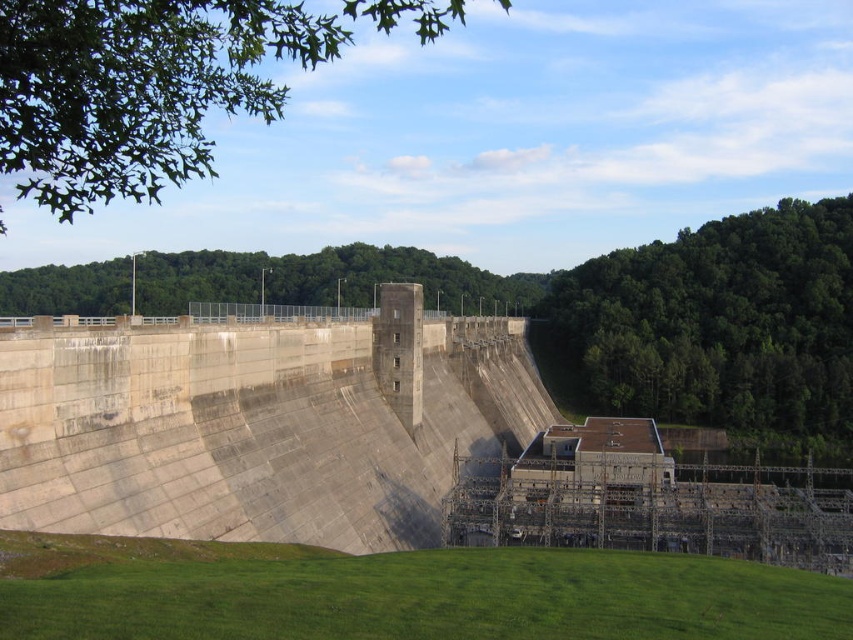
Is point (672, 380) positioned in front of point (1, 292)?

Yes, point (672, 380) is closer to viewer.

Is point (791, 368) farther from camera compared to point (28, 275)?

No, it is in front of (28, 275).

This screenshot has width=853, height=640. Identify the location of green leafy tree at right. (718, 323).

In the scene shown: Who is higher up, gray concrete dam at center or green leafy tree at right?

green leafy tree at right

Is gray concrete dam at center shorter than green leafy tree at right?

Yes.

Between point (531, 433) and point (709, 266), which one is positioned in front?

Point (531, 433) is in front.

You are a GUI agent. You are given a task and a screenshot of the screen. Output one action in this format:
    pyautogui.click(x=<x>, y=<y>)
    Task: Click on the gray concrete dam at center
    The height and width of the screenshot is (640, 853).
    Given the screenshot: What is the action you would take?
    pyautogui.click(x=259, y=424)

Is green leafy tree at right smaller than green leafy tree at upper left?

Yes.

Between green leafy tree at right and green leafy tree at upper left, which one is positioned higher?

Positioned higher is green leafy tree at upper left.

This screenshot has width=853, height=640. I want to click on green leafy tree at right, so point(718,323).